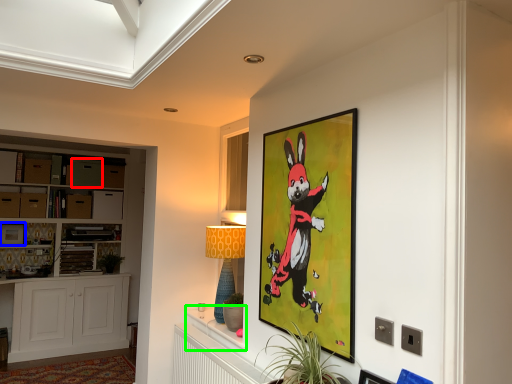
Question: Considering the real-world distances, which object is closest to drawer (highlighted by a red box)? picture frame (highlighted by a blue box) or table (highlighted by a green box).

Choices:
 (A) picture frame
 (B) table

Answer: (A)